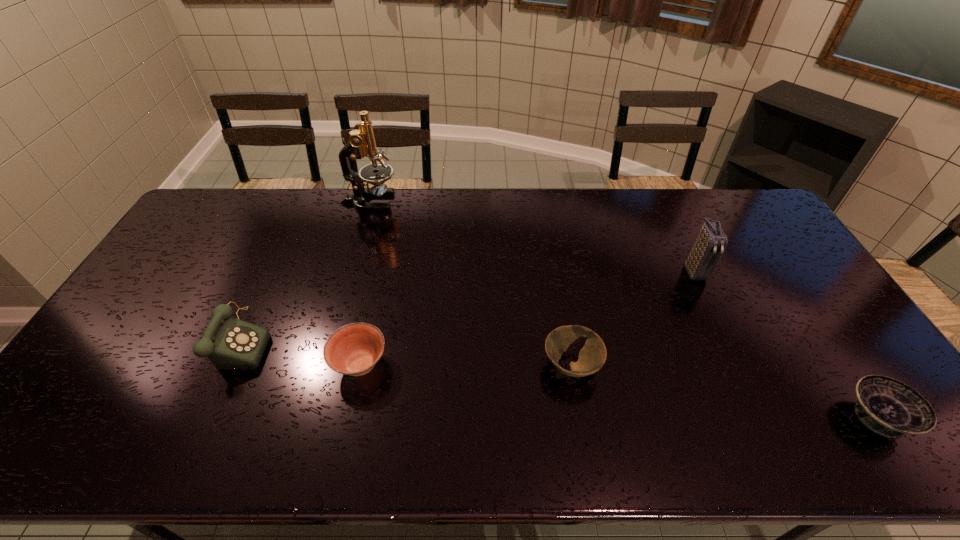
Find the location of a particular element. The width and height of the screenshot is (960, 540). vacant space at the near edge is located at coordinates (494, 436).

The height and width of the screenshot is (540, 960). What are the coordinates of `vacant space at the left edge of the desktop` in the screenshot? It's located at (55, 411).

At what (x,y) coordinates should I click in order to perform the action: click on vacant space at the right edge of the desktop. Please return your answer as a coordinate pair (x, y). Image resolution: width=960 pixels, height=540 pixels. Looking at the image, I should click on (776, 255).

Identify the location of blank area at the far left corner. The width and height of the screenshot is (960, 540). (220, 222).

Find the location of a particular element. Image resolution: width=960 pixels, height=540 pixels. free space between the second bowl from right to left and the leftmost bowl is located at coordinates (466, 364).

Locate an element on the screen. Image resolution: width=960 pixels, height=540 pixels. free space that is in between the leftmost bowl and the clutch bag is located at coordinates (527, 318).

The height and width of the screenshot is (540, 960). In order to click on free point between the farthest object and the rightmost bowl in this screenshot , I will do (623, 309).

The image size is (960, 540). Find the location of `empty space that is in between the third tallest object and the second bowl from right to left`. empty space that is in between the third tallest object and the second bowl from right to left is located at coordinates (406, 353).

Locate an element on the screen. This screenshot has width=960, height=540. vacant area that lies between the fourth object from left to right and the telephone is located at coordinates (406, 353).

The height and width of the screenshot is (540, 960). What are the coordinates of `free space between the rightmost bowl and the microscope` in the screenshot? It's located at (623, 309).